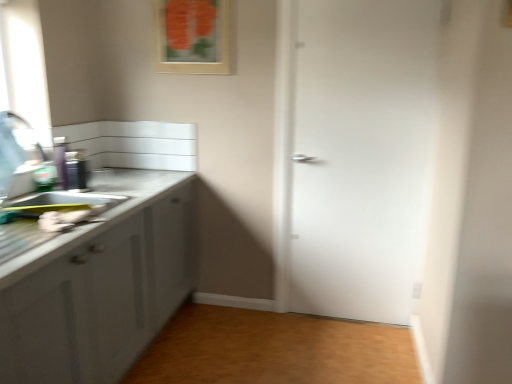
This screenshot has width=512, height=384. What are the coordinates of `vacant space underneath white matte door at center (from a real-world perspective)` in the screenshot? It's located at (346, 320).